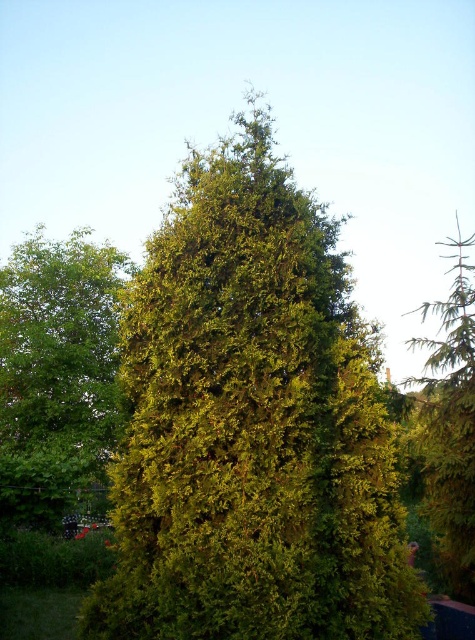
You are standing in a garden and see the green leafy tree at center and the green textured evergreen tree at right. Which tree is taller?

The green textured evergreen tree at right is taller than the green leafy tree at center.

What are the coordinates of the green leafy tree at center?

The green leafy tree at center is located at coordinates point (x=56, y=372).

Looking at this image, you are standing in a garden and see the green textured tree at center and the green leafy tree at center. Which tree is closer to you?

The green textured tree at center is closer to you because it is in front of the green leafy tree at center.